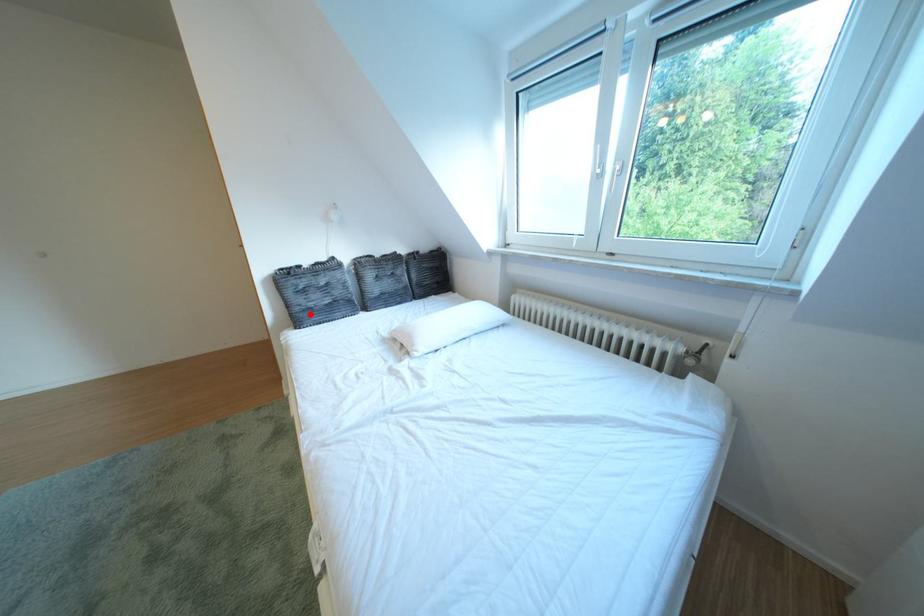
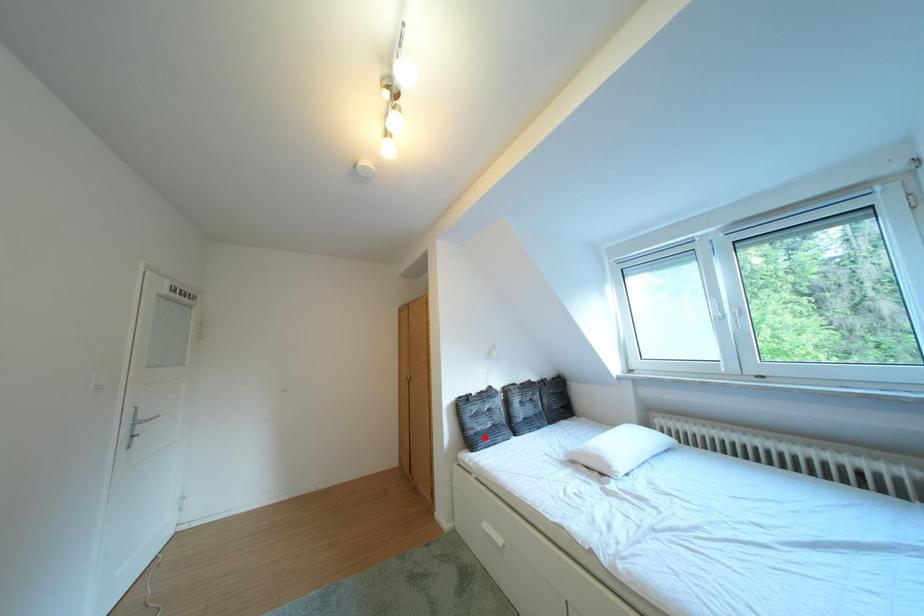
I am providing you with two images of the same scene from different viewpoints. A red point is marked on the first image and another point is marked on the second image. Does the point marked in image1 correspond to the same location as the one in image2?

Yes